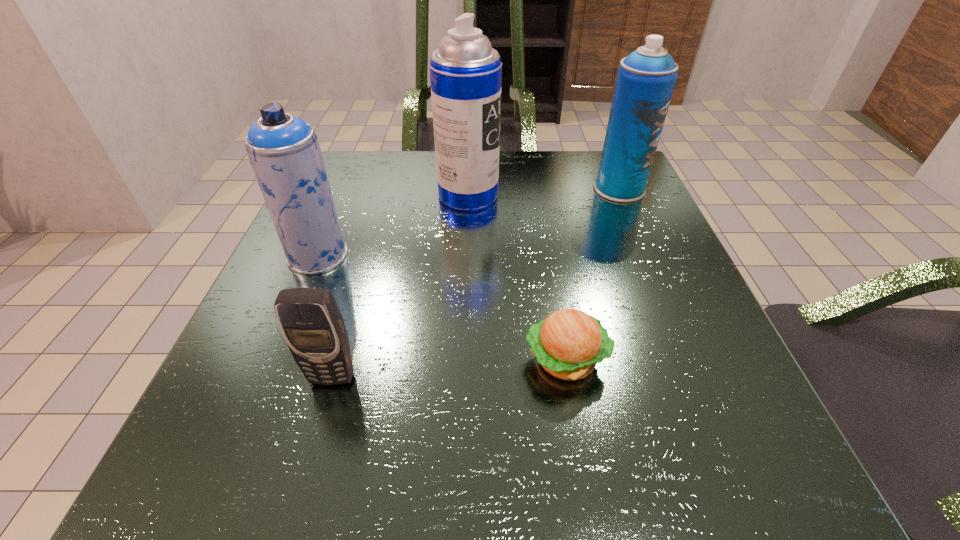
Find the location of a particular element. The image size is (960, 540). free space at the far left corner of the desktop is located at coordinates (372, 166).

The height and width of the screenshot is (540, 960). Find the location of `vacant space at the far right corner of the desktop`. vacant space at the far right corner of the desktop is located at coordinates (573, 184).

The height and width of the screenshot is (540, 960). In order to click on vacant area at the near right corner of the desktop in this screenshot , I will do `click(718, 437)`.

At what (x,y) coordinates should I click in order to perform the action: click on vacant area that lies between the cellular telephone and the fourth object from left to right. Please return your answer as a coordinate pair (x, y). This screenshot has height=540, width=960. Looking at the image, I should click on (449, 369).

You are a GUI agent. You are given a task and a screenshot of the screen. Output one action in this format:
    pyautogui.click(x=<x>, y=<y>)
    Task: Click on the vacant area between the second aerosol can from right to left and the hamburger
    The width and height of the screenshot is (960, 540).
    Given the screenshot: What is the action you would take?
    pyautogui.click(x=517, y=278)

Identify the location of vacant space that's between the hamburger and the third nearest object. The height and width of the screenshot is (540, 960). (442, 307).

Locate an element on the screen. The image size is (960, 540). vacant space that is in between the rightmost object and the cellular telephone is located at coordinates (476, 283).

At what (x,y) coordinates should I click in order to perform the action: click on vacant space that's between the hamburger and the rightmost object. Please return your answer as a coordinate pair (x, y). Looking at the image, I should click on (592, 274).

This screenshot has height=540, width=960. In order to click on free spot between the second aerosol can from left to right and the shortest object in this screenshot , I will do `click(517, 278)`.

At what (x,y) coordinates should I click in order to perform the action: click on vacant region between the hamburger and the fourth object from right to left. Please return your answer as a coordinate pair (x, y). Looking at the image, I should click on (449, 369).